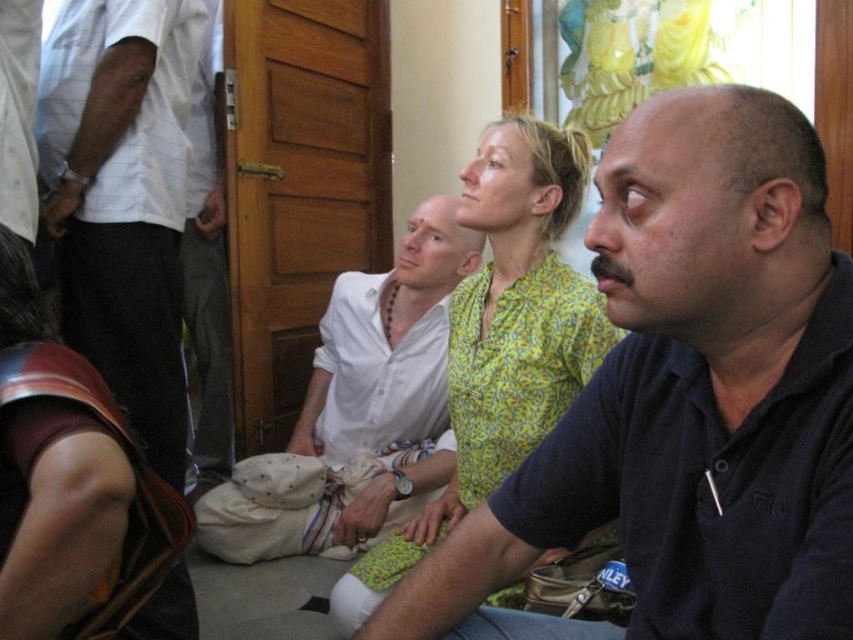
You are standing in the room and want to reach the point marked as point (685, 118). If your arm is 70 centimeters long, can you reach it without moving your feet?

The point (685, 118) is 73.82 centimeters away from you. Since your arm is only 70 centimeters long, you cannot reach it without moving your feet.

You are standing at the origin of the coordinate system in the room. There is a point at coordinates point (688,400). What object is located at that point?

The dark blue polo shirt at center is located at point (688,400).

You are standing in the room and want to move from the point at coordinate (503, 582) to the point at coordinate (3, 522). Which direction should you move in?

You should move downward and to the left because point (3, 522) is located below and to the left of point (503, 582).